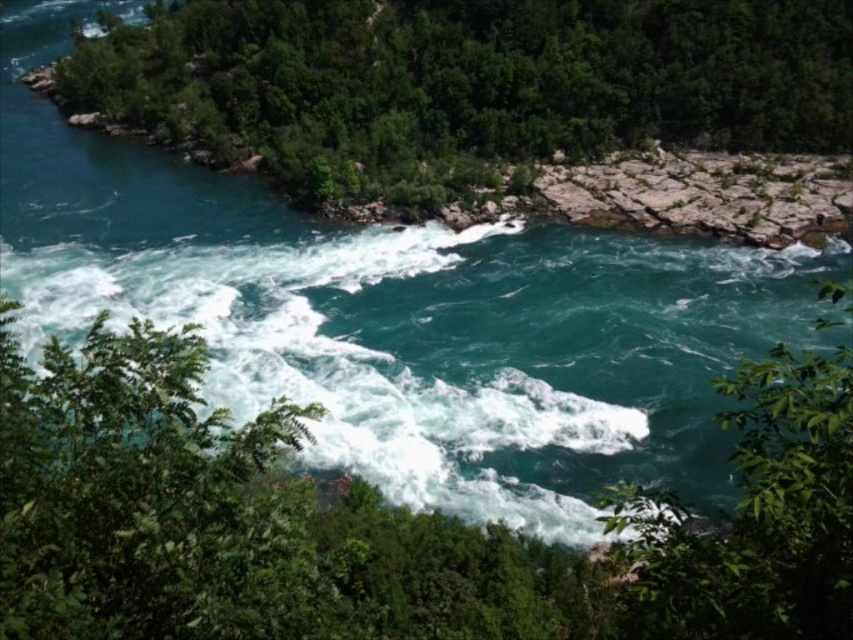
Question: Does green leafy tree at upper left have a larger size compared to green leafy tree at center?

Choices:
 (A) no
 (B) yes

Answer: (B)

Question: Among these points, which one is nearest to the camera?

Choices:
 (A) (845, 612)
 (B) (378, 1)

Answer: (A)

Question: Does green leafy tree at upper left have a lesser width compared to green leafy tree at center?

Choices:
 (A) no
 (B) yes

Answer: (A)

Question: Is green leafy tree at upper left positioned before green leafy tree at center?

Choices:
 (A) no
 (B) yes

Answer: (A)